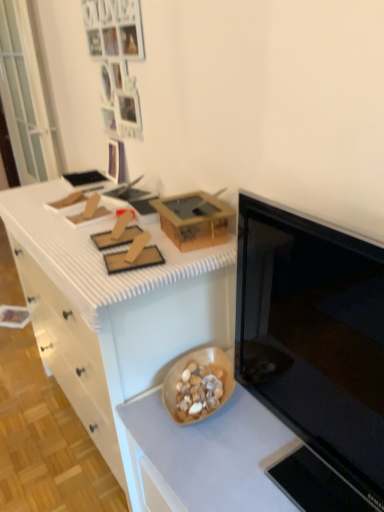
Question: In terms of width, does wooden bowl at lower center, which is the 2th countertop from top to bottom, look wider or thinner when compared to transparent glass door at left?

Choices:
 (A) wide
 (B) thin

Answer: (A)

Question: Considering the positions of point (163, 442) and point (18, 31), is point (163, 442) closer or farther from the camera than point (18, 31)?

Choices:
 (A) closer
 (B) farther

Answer: (A)

Question: Which is nearer to the white textured countertop at upper left, the first countertop viewed from the top?

Choices:
 (A) matte brown cardboard box at center
 (B) black glossy microwave at right
 (C) transparent glass door at left
 (D) wooden bowl at lower center, the first countertop when ordered from bottom to top
 (E) white matte drawer at left

Answer: (A)

Question: Which object is the farthest from the wooden bowl at lower center, the first countertop when ordered from bottom to top?

Choices:
 (A) black glossy microwave at right
 (B) transparent glass door at left
 (C) white textured countertop at upper left, the first countertop viewed from the top
 (D) white matte drawer at left
 (E) matte brown cardboard box at center

Answer: (B)